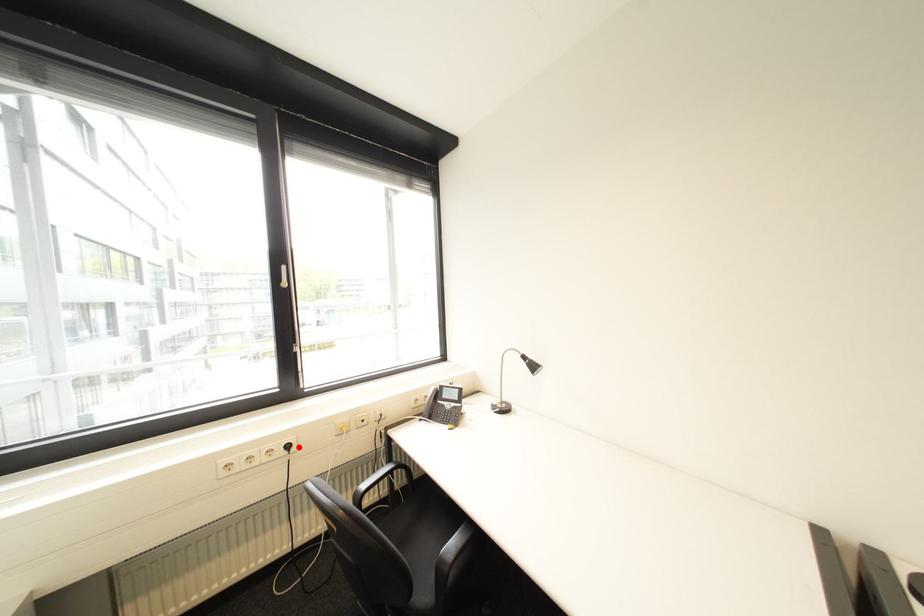
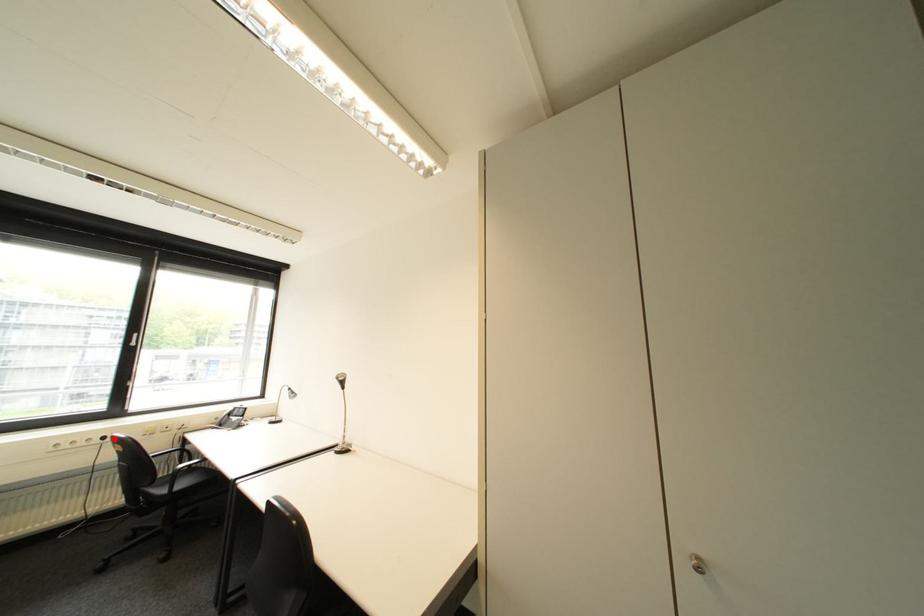
I am providing you with two images of the same scene from different viewpoints. A red point is marked on the first image and another point is marked on the second image. Are the points marked in image1 and image2 representing the same 3D position?

Yes